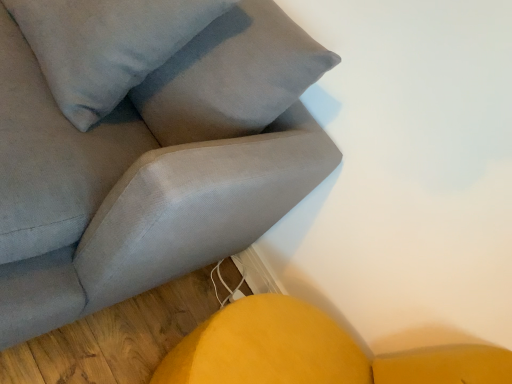
Question: From a real-world perspective, is suede gray couch at upper left located higher than satin gray pillow at upper left?

Choices:
 (A) no
 (B) yes

Answer: (A)

Question: Is suede gray couch at upper left at the right side of satin gray pillow at upper left?

Choices:
 (A) no
 (B) yes

Answer: (A)

Question: Considering the relative sizes of suede gray couch at upper left and satin gray pillow at upper left in the image provided, is suede gray couch at upper left shorter than satin gray pillow at upper left?

Choices:
 (A) no
 (B) yes

Answer: (A)

Question: Is suede gray couch at upper left beside satin gray pillow at upper left?

Choices:
 (A) yes
 (B) no

Answer: (B)

Question: Can you confirm if suede gray couch at upper left is bigger than satin gray pillow at upper left?

Choices:
 (A) yes
 (B) no

Answer: (A)

Question: Considering the relative sizes of suede gray couch at upper left and satin gray pillow at upper left in the image provided, is suede gray couch at upper left taller than satin gray pillow at upper left?

Choices:
 (A) no
 (B) yes

Answer: (B)

Question: Is satin gray pillow at upper left not close to suede gray couch at upper left?

Choices:
 (A) yes
 (B) no

Answer: (B)

Question: Considering the relative sizes of satin gray pillow at upper left and suede gray couch at upper left in the image provided, is satin gray pillow at upper left thinner than suede gray couch at upper left?

Choices:
 (A) yes
 (B) no

Answer: (A)

Question: From a real-world perspective, is satin gray pillow at upper left on top of suede gray couch at upper left?

Choices:
 (A) no
 (B) yes

Answer: (B)

Question: Is satin gray pillow at upper left turned away from suede gray couch at upper left?

Choices:
 (A) yes
 (B) no

Answer: (A)

Question: From a real-world perspective, is satin gray pillow at upper left beneath suede gray couch at upper left?

Choices:
 (A) yes
 (B) no

Answer: (B)

Question: Is satin gray pillow at upper left taller than suede gray couch at upper left?

Choices:
 (A) no
 (B) yes

Answer: (A)

Question: Based on their sizes in the image, would you say suede gray couch at upper left is bigger or smaller than satin gray pillow at upper left?

Choices:
 (A) small
 (B) big

Answer: (B)